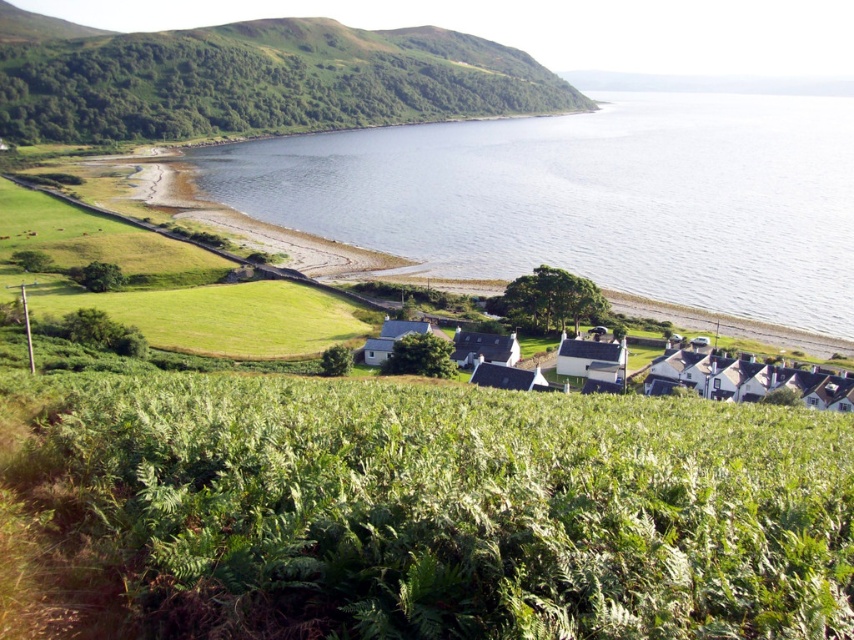
Question: Is green leafy vineyard at lower center positioned behind clear blue water at center?

Choices:
 (A) no
 (B) yes

Answer: (A)

Question: Does green grassy hillside at upper left have a lesser width compared to white wooden houses at center?

Choices:
 (A) no
 (B) yes

Answer: (A)

Question: Does clear blue water at center have a lesser width compared to white wooden houses at center?

Choices:
 (A) yes
 (B) no

Answer: (B)

Question: Based on their relative distances, which object is farther from the clear blue water at center?

Choices:
 (A) green leafy vineyard at lower center
 (B) white wooden houses at center

Answer: (A)

Question: Which object is the farthest from the green leafy vineyard at lower center?

Choices:
 (A) clear blue water at center
 (B) green grassy hillside at upper left

Answer: (B)

Question: Which object is the farthest from the white wooden houses at center?

Choices:
 (A) clear blue water at center
 (B) green grassy hillside at upper left
 (C) green leafy vineyard at lower center

Answer: (B)